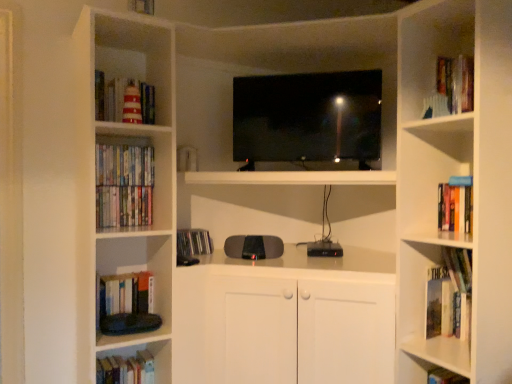
Where is `free location above matte plastic dvds at left, placed as the 6th book when sorted from bottom to top (from a real-world perspective)`? The image size is (512, 384). free location above matte plastic dvds at left, placed as the 6th book when sorted from bottom to top (from a real-world perspective) is located at coordinates (117, 145).